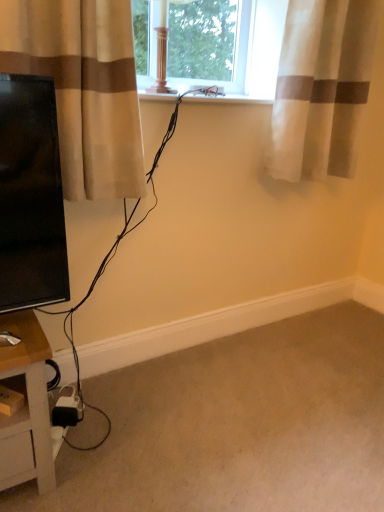
The height and width of the screenshot is (512, 384). I want to click on vacant space underneath beige fabric curtain at left, which is the 1th curtain from front to back (from a real-world perspective), so click(x=100, y=388).